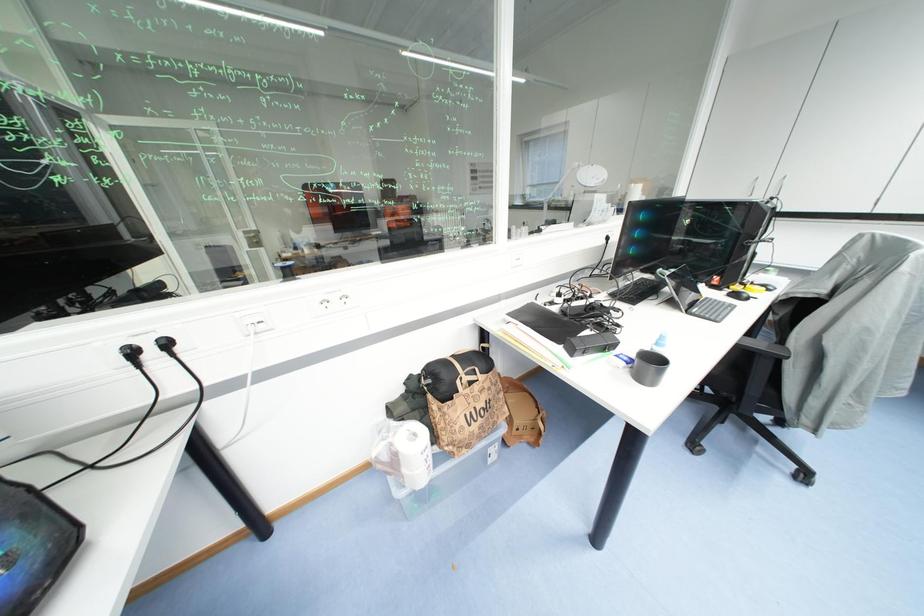
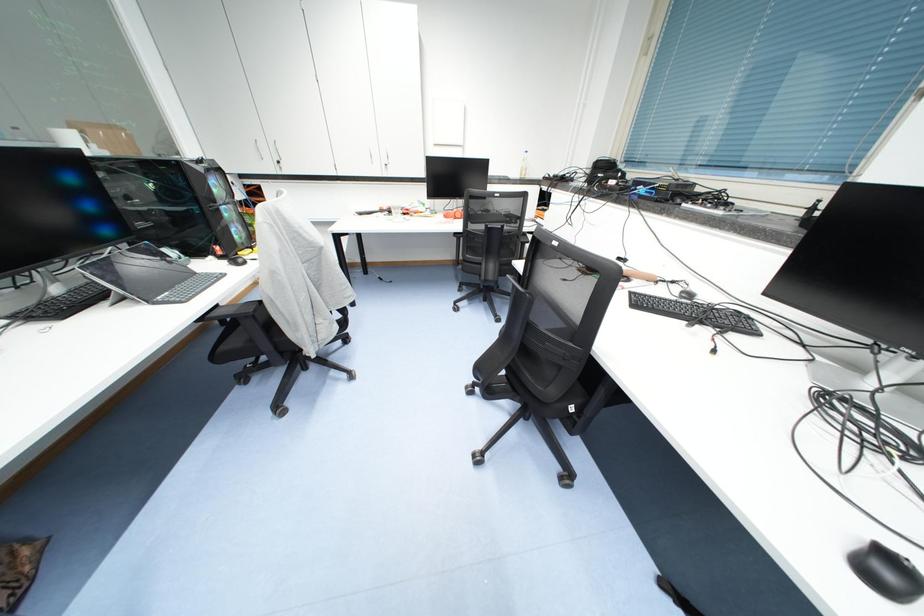
Consider the image. Based on the continuous images, in which direction is the camera rotating?

The camera's rotation is toward right-down.